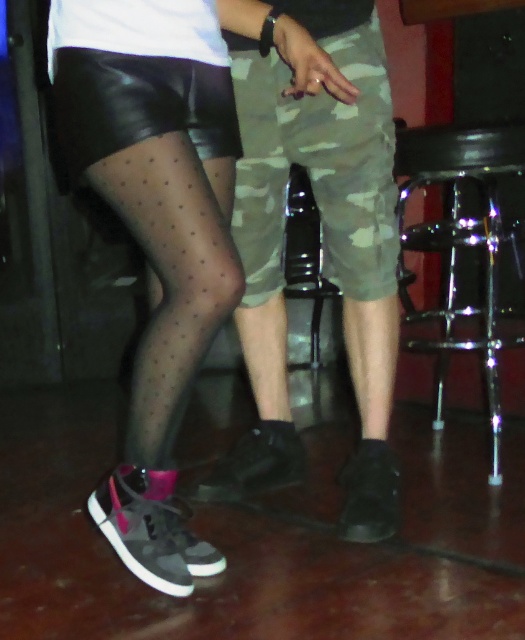
Who is lower down, camo fabric shorts at center or camouflage fabric shorts at center?

camo fabric shorts at center

Between point (394, 346) and point (244, 54), which one is positioned behind?

The point (394, 346) is more distant.

I want to click on camo fabric shorts at center, so click(x=324, y=250).

Who is taller, camouflage fabric shorts at center or shiny chrome bar stool at right?

Standing taller between the two is shiny chrome bar stool at right.

Is camouflage fabric shorts at center bigger than shiny chrome bar stool at right?

No.

Between point (257, 68) and point (444, 227), which one is positioned in front?

Point (257, 68) is in front.

At what (x,y) coordinates should I click in order to perform the action: click on camouflage fabric shorts at center. Please return your answer as a coordinate pair (x, y). This screenshot has width=525, height=640. Looking at the image, I should click on (318, 156).

Based on the photo, does camo fabric shorts at center have a greater height compared to shiny chrome bar stool at right?

Yes, camo fabric shorts at center is taller than shiny chrome bar stool at right.

The height and width of the screenshot is (640, 525). I want to click on camo fabric shorts at center, so click(x=324, y=250).